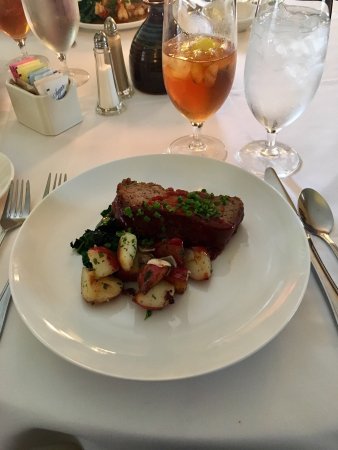
Locate an element on the screen. plate is located at coordinates (130, 345).